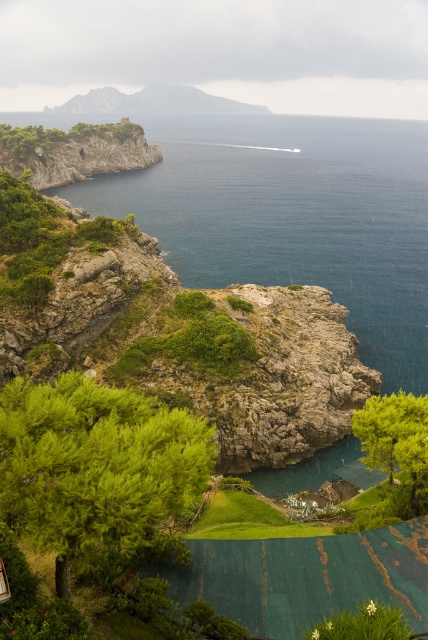
You are a hiker standing at the base of the cliff looking towards the sea. You notice two green leafy trees in the scene. Which tree would appear closer to you, the green leafy tree at lower left or the green leafy tree at center?

The green leafy tree at lower left appears closer because it is bigger than the green leafy tree at center, and larger objects in the foreground typically appear closer to the observer.

You are standing on the cliff and looking out at the scene. Which object is higher in your field of view, the deep blue water at upper center or the green leafy tree at lower left?

The deep blue water at upper center is higher in your field of view than the green leafy tree at lower left because it is positioned above it.